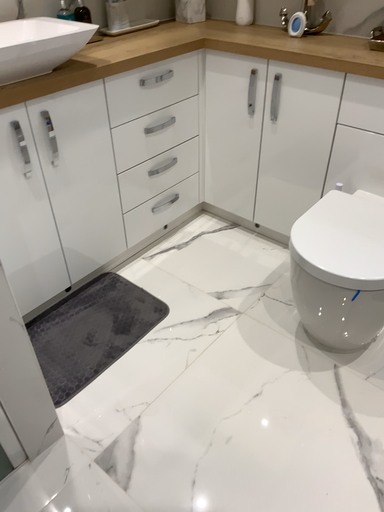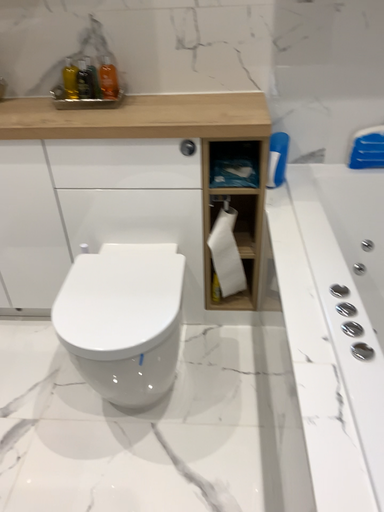
Question: Which way did the camera rotate in the video?

Choices:
 (A) rotated downward
 (B) rotated upward

Answer: (B)